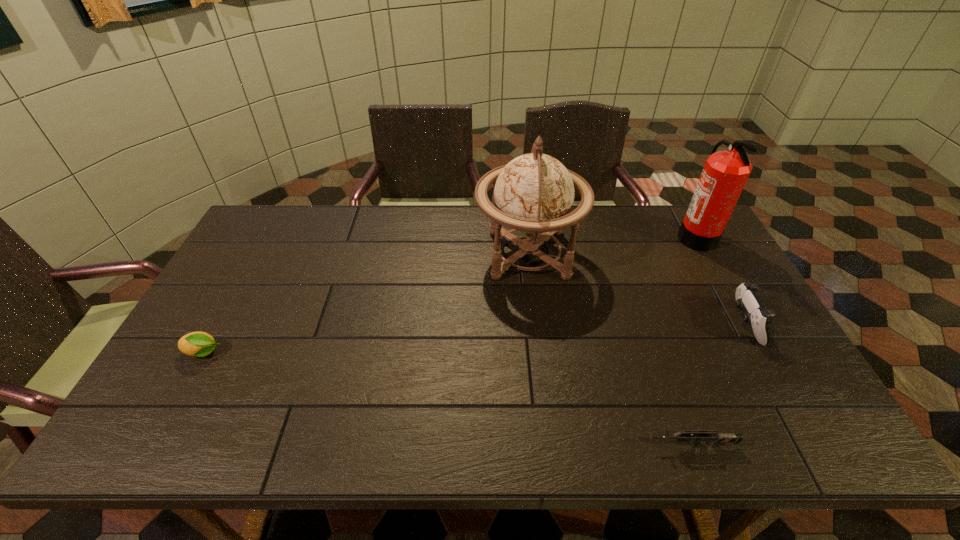
Where is `vacant point located between the lemon and the fire extinguisher`? The height and width of the screenshot is (540, 960). vacant point located between the lemon and the fire extinguisher is located at coordinates (449, 295).

Where is `the second closest object to the control`? the second closest object to the control is located at coordinates (717, 438).

Choose which object is the fourth nearest neighbor to the third tallest object. Please provide its 2D coordinates. Your answer should be formatted as a tuple, i.e. [(x, y)], where the tuple contains the x and y coordinates of a point satisfying the conditions above.

[(200, 344)]